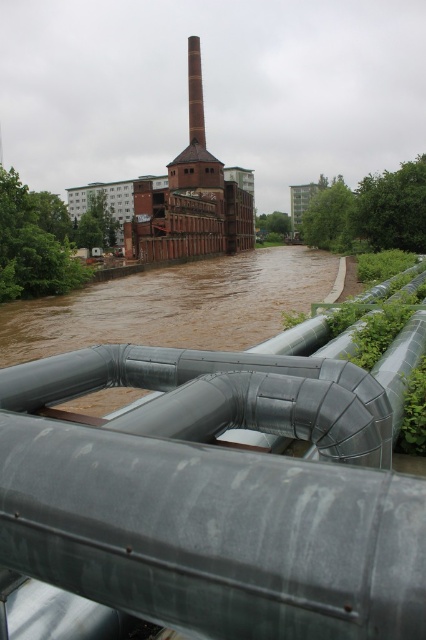
You are standing at a point 9.61 meters away from the camera. You want to take a photo of the industrial building in the background. Is the point at point [299,420] in front of or behind the industrial building?

The point at point [299,420] is 9.61 meters away from the camera. Since the industrial building is in the background, it is farther away than the foreground elements like the pipes. However, the point in question is at 9.61 meters, which is likely part of the foreground pipes. Therefore, the point is in front of the industrial building.

You are standing in front of the industrial building and notice two points marked on the metallic pipes. Which point, point 1 at coordinates (x=103, y=528) or point 2 at coordinates (x=198, y=134), is closer to you?

Point 1 at coordinates (x=103, y=528) is closer to the viewer than point 2 at coordinates (x=198, y=134).

You are a city planner assessing flood risks. You notice the galvanized steel pipes at center and the red brick chimney at center. Which structure is taller in the image?

The red brick chimney at center is taller than the galvanized steel pipes at center.